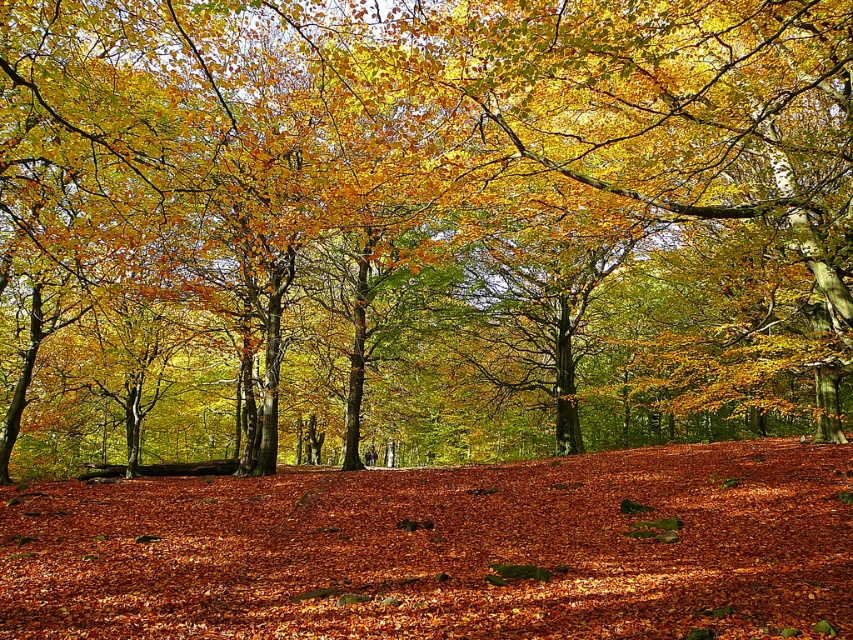
Question: Does golden glossy leaves at center come in front of brown leaf litter at center?

Choices:
 (A) yes
 (B) no

Answer: (B)

Question: Does golden glossy leaves at center appear under brown leaf litter at center?

Choices:
 (A) no
 (B) yes

Answer: (A)

Question: Is golden glossy leaves at center bigger than brown leaf litter at center?

Choices:
 (A) no
 (B) yes

Answer: (B)

Question: Which point appears closest to the camera in this image?

Choices:
 (A) (561, 464)
 (B) (804, 321)

Answer: (A)